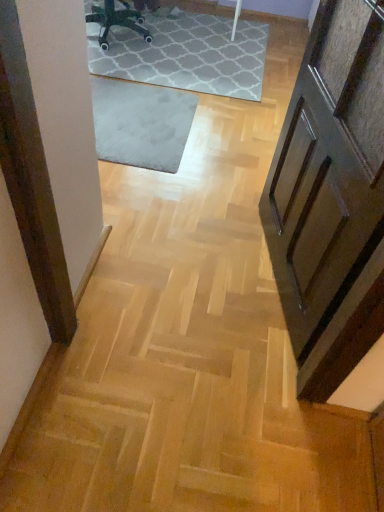
I want to click on vacant region below black plastic chair at upper center (from a real-world perspective), so click(x=135, y=45).